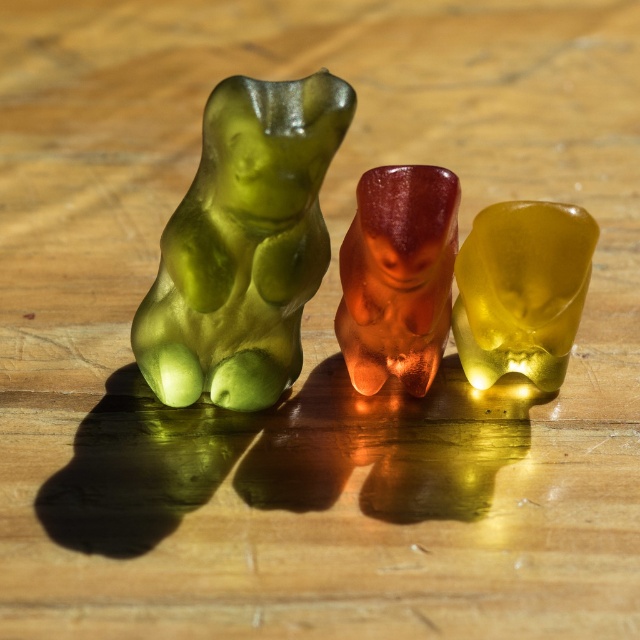
Describe the element at coordinates (243, 244) in the screenshot. I see `green translucent bear at center` at that location.

Between green translucent bear at center and translucent yellow bear at center, which one has more height?

Standing taller between the two is green translucent bear at center.

Which is in front, point (253, 406) or point (500, 332)?

Positioned in front is point (500, 332).

Where is `green translucent bear at center`? green translucent bear at center is located at coordinates (243, 244).

Which is more to the left, green translucent bear at center or translucent amber bear at center?

green translucent bear at center

Does green translucent bear at center have a lesser height compared to translucent amber bear at center?

No, green translucent bear at center is not shorter than translucent amber bear at center.

Where is `green translucent bear at center`? green translucent bear at center is located at coordinates (243, 244).

Can you confirm if translucent amber bear at center is positioned below translucent yellow bear at center?

Actually, translucent amber bear at center is above translucent yellow bear at center.

Is point (451, 262) farther from camera compared to point (476, 225)?

Yes, it is.

Image resolution: width=640 pixels, height=640 pixels. Describe the element at coordinates (397, 275) in the screenshot. I see `translucent amber bear at center` at that location.

At what (x,y) coordinates should I click in order to perform the action: click on translucent amber bear at center. Please return your answer as a coordinate pair (x, y). Looking at the image, I should click on (397, 275).